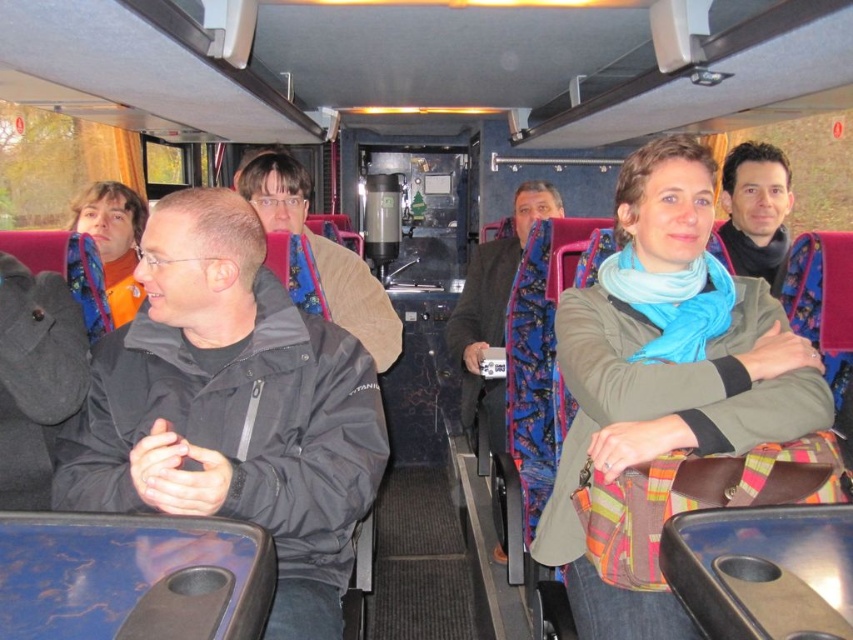
Question: Among these objects, which one is farthest from the camera?

Choices:
 (A) black matte jacket at left
 (B) blue patterned coat at center
 (C) light blue scarf at center

Answer: (B)

Question: Does black matte jacket at left have a smaller size compared to light blue scarf at center?

Choices:
 (A) no
 (B) yes

Answer: (A)

Question: Is the position of black matte jacket at left less distant than that of light blue scarf at center?

Choices:
 (A) yes
 (B) no

Answer: (A)

Question: Among these points, which one is nearest to the camera?

Choices:
 (A) (618, 269)
 (B) (234, 356)

Answer: (B)

Question: Can you confirm if light blue scarf at center is thinner than blue patterned coat at center?

Choices:
 (A) yes
 (B) no

Answer: (B)

Question: Which of these objects is positioned closest to the black matte jacket at left?

Choices:
 (A) blue patterned coat at center
 (B) light blue scarf at center

Answer: (B)